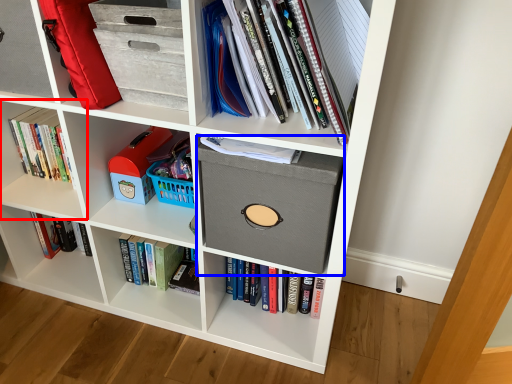
Question: Which point is further to the camera, shelf (highlighted by a red box) or cardboard box (highlighted by a blue box)?

Choices:
 (A) shelf
 (B) cardboard box

Answer: (A)